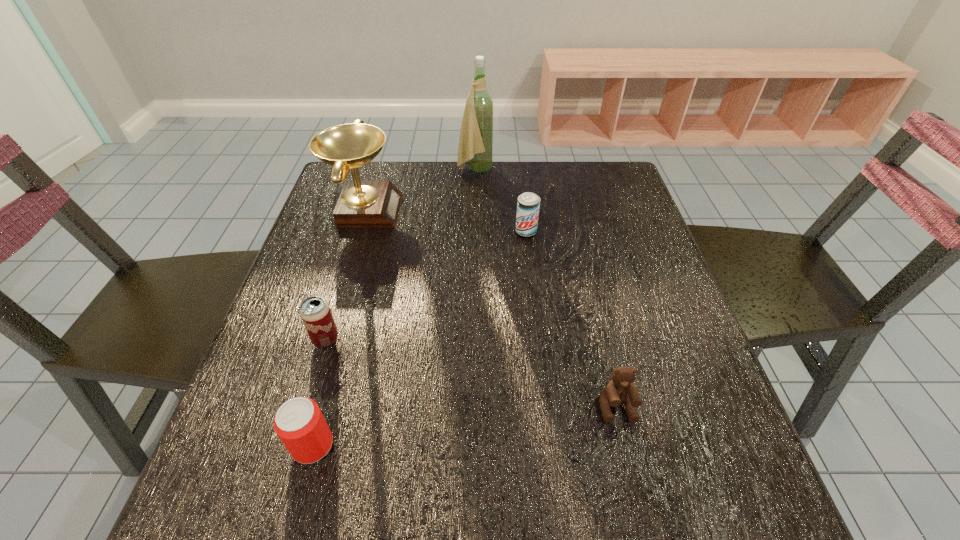
Find the location of `vacant space at the far edge of the desktop`. vacant space at the far edge of the desktop is located at coordinates (x=435, y=161).

This screenshot has height=540, width=960. I want to click on vacant area at the left edge of the desktop, so tap(327, 230).

Where is `free space at the right edge of the desktop`? This screenshot has height=540, width=960. free space at the right edge of the desktop is located at coordinates (628, 253).

Where is `free space at the far left corner of the desktop`? This screenshot has width=960, height=540. free space at the far left corner of the desktop is located at coordinates (387, 166).

I want to click on free space at the near left corner of the desktop, so click(x=307, y=475).

The height and width of the screenshot is (540, 960). In the image, there is a desktop. What are the coordinates of `vacant space at the far right corner` in the screenshot? It's located at (587, 202).

Locate an element on the screen. The image size is (960, 540). vacant space that is in between the farthest object and the award is located at coordinates (420, 190).

Locate an element on the screen. This screenshot has height=540, width=960. free area in between the rightmost object and the fifth shortest object is located at coordinates (491, 308).

Locate an element on the screen. The width and height of the screenshot is (960, 540). free space between the rightmost object and the fifth object from left to right is located at coordinates (571, 319).

The width and height of the screenshot is (960, 540). What are the coordinates of `free area in between the rightmost beer can and the second farthest beer can` in the screenshot? It's located at (426, 285).